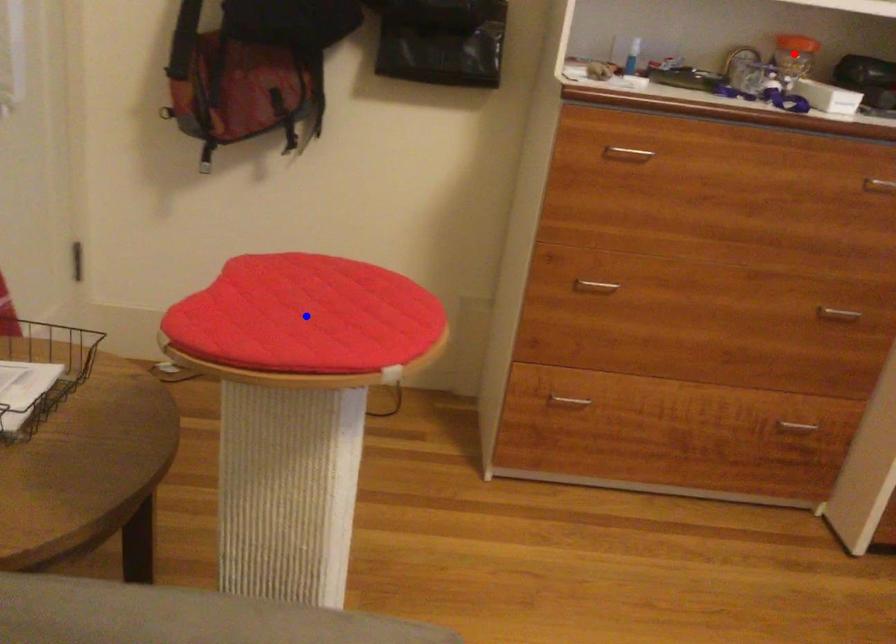
Question: Two points are marked on the image. Which point is closer to the camera?

Choices:
 (A) Blue point is closer.
 (B) Red point is closer.

Answer: (A)